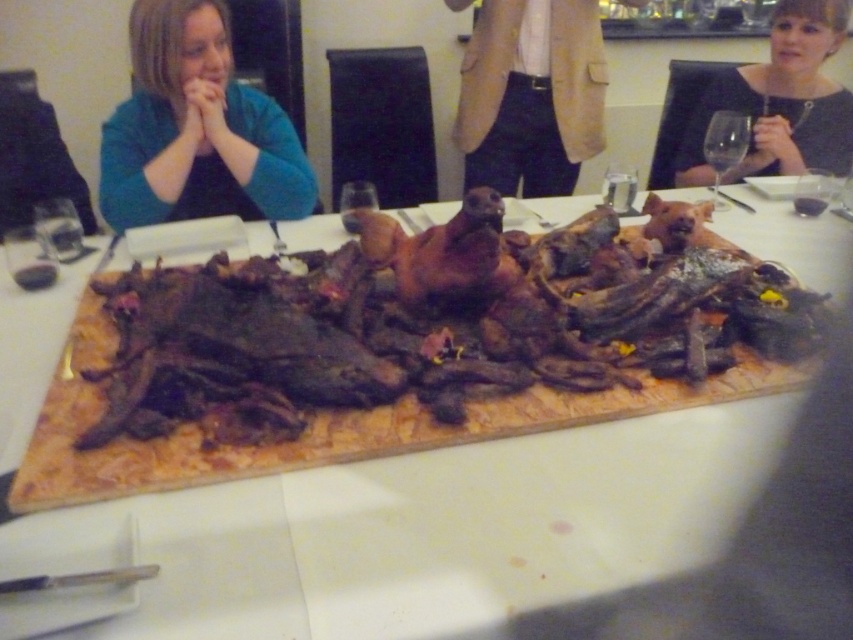
You are standing at the point marked as point [125,104] and want to reach the dining table where the roasted meat is placed. The minimum distance you need to cover is 1.78 meters. Can you walk straight to the table without any obstacles?

Yes, since the distance between you and the dining table is exactly 1.78 meters, you can walk straight to the table without any obstacles.

You are at a family gathering and want to pass a dish from the brown wooden board at center to the person wearing the dark gray dress at upper right. Which direction should you move the dish to reach them?

The dark gray dress at upper right is on the right side of the brown wooden board at center, so you should move the dish to the right to reach them.